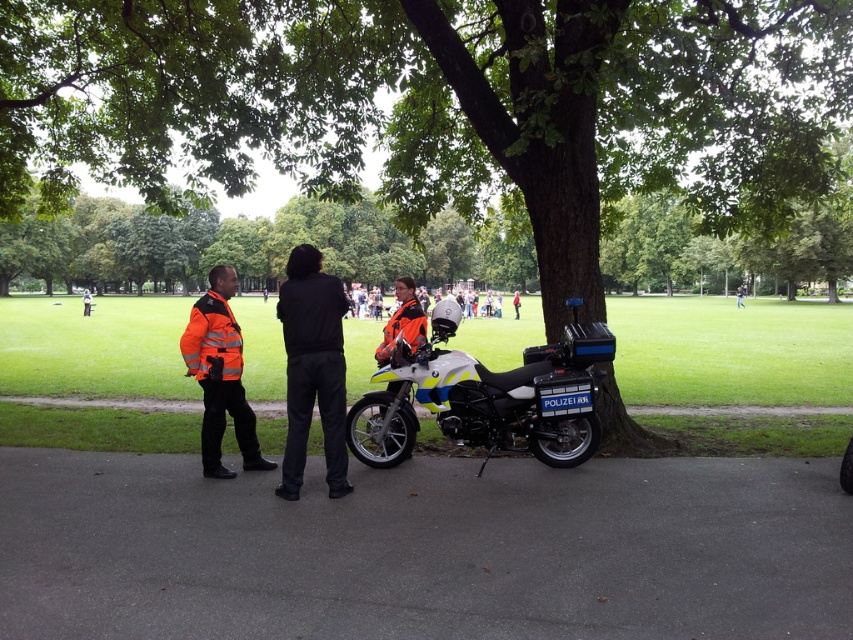
Question: Based on their relative distances, which object is farther from the high-visibility orange jacket at center?

Choices:
 (A) orange reflective jacket at center
 (B) black matte pants at center
 (C) white matte motorcycle at center

Answer: (C)

Question: Which object is the closest to the green leafy tree at center?

Choices:
 (A) high-visibility orange jacket at center
 (B) black matte pants at center

Answer: (A)

Question: Is white matte motorcycle at center smaller than black matte pants at center?

Choices:
 (A) yes
 (B) no

Answer: (A)

Question: Does black matte pants at center appear on the left side of high-visibility orange jacket at center?

Choices:
 (A) yes
 (B) no

Answer: (B)

Question: Which object is the farthest from the high-visibility orange jacket at center?

Choices:
 (A) orange reflective jacket at center
 (B) black matte pants at center
 (C) green leafy tree at center
 (D) white matte motorcycle at center

Answer: (C)

Question: Can you confirm if white matte motorcycle at center is positioned above orange reflective jacket at center?

Choices:
 (A) yes
 (B) no

Answer: (B)